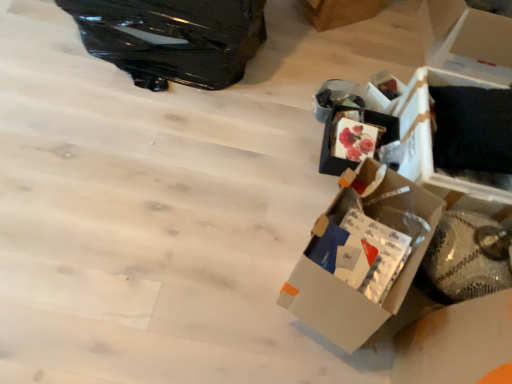
Identify the location of free point to the left of black cardboard box at right, arranged as the 2th storage box when viewed from the back. (300, 155).